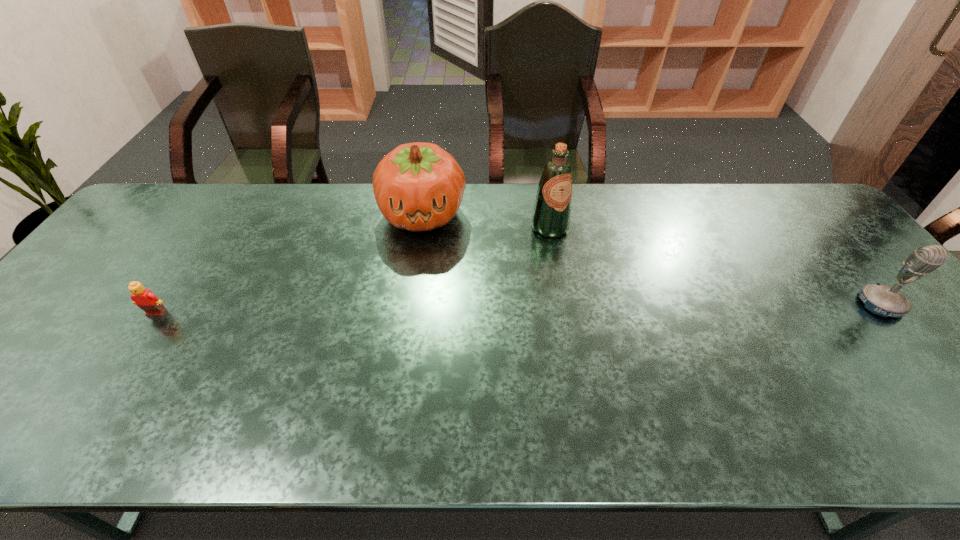
What are the coordinates of `vacant space located 0.220m on the side of the pumpkin with the cute face` in the screenshot? It's located at (420, 299).

This screenshot has height=540, width=960. I want to click on vacant space located 0.250m on the front-facing side of the second object from right to left, so click(x=605, y=296).

At what (x,y) coordinates should I click in order to perform the action: click on free spot located on the front-facing side of the second object from right to left. Please return your answer as a coordinate pair (x, y). This screenshot has width=960, height=540. Looking at the image, I should click on (568, 251).

The width and height of the screenshot is (960, 540). Identify the location of free spot located 0.290m on the front-facing side of the second object from right to left. (613, 307).

Find the location of a particular element. Image resolution: width=960 pixels, height=540 pixels. pumpkin present at the far edge is located at coordinates (418, 186).

What are the coordinates of `olive oil present at the far edge` in the screenshot? It's located at (551, 215).

The height and width of the screenshot is (540, 960). In order to click on object that is at the right edge in this screenshot , I will do `click(883, 300)`.

In the image, there is a desktop. What are the coordinates of `vacant space at the far edge` in the screenshot? It's located at (598, 185).

At what (x,y) coordinates should I click in order to perform the action: click on vacant space at the near edge. Please return your answer as a coordinate pair (x, y). This screenshot has height=540, width=960. Looking at the image, I should click on (446, 397).

This screenshot has width=960, height=540. In order to click on vacant area at the left edge in this screenshot , I will do `click(136, 278)`.